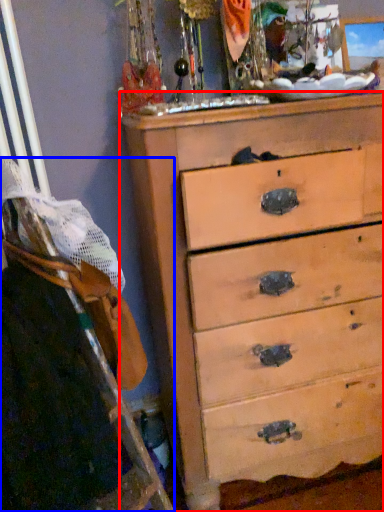
Question: Among these objects, which one is nearest to the camera, chest of drawers (highlighted by a red box) or ladder (highlighted by a blue box)?

Choices:
 (A) chest of drawers
 (B) ladder

Answer: (B)